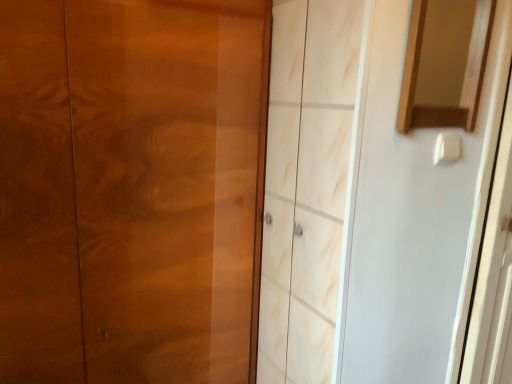
Question: Is glossy wood door at left bigger or smaller than wooden mirror at upper right?

Choices:
 (A) big
 (B) small

Answer: (A)

Question: Is glossy wood door at left situated inside wooden mirror at upper right or outside?

Choices:
 (A) inside
 (B) outside

Answer: (B)

Question: Estimate the real-world distances between objects in this image. Which object is closer to the white glossy screen door at right?

Choices:
 (A) glossy wood door at left
 (B) wooden mirror at upper right

Answer: (B)

Question: Estimate the real-world distances between objects in this image. Which object is farther from the glossy wood door at left?

Choices:
 (A) white glossy screen door at right
 (B) wooden mirror at upper right

Answer: (A)